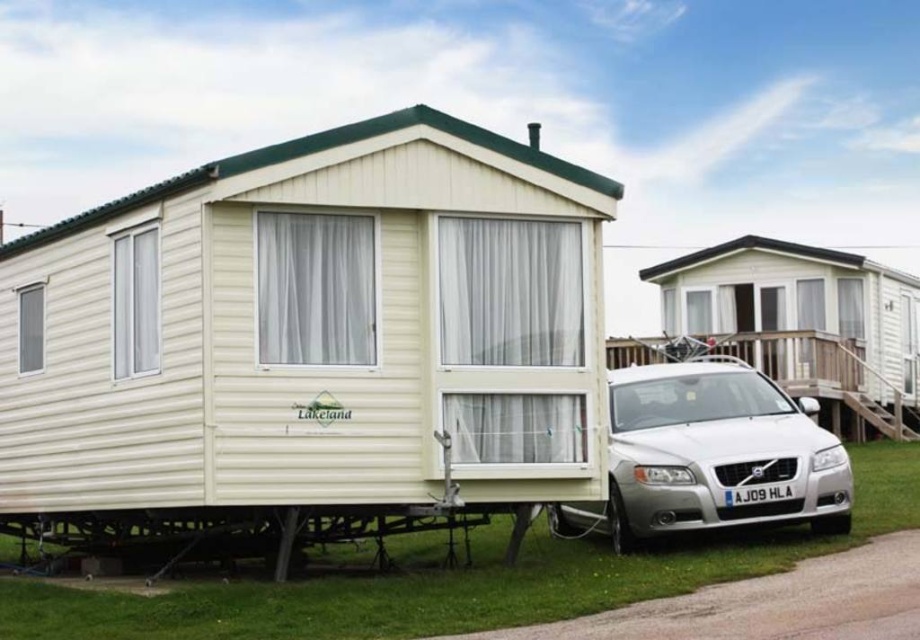
Looking at this image, you are standing at the mobile home and want to walk to the car parked in front. Which point, point (x=600, y=324) or point (x=662, y=502), is closer to the car?

Point (x=600, y=324) is closer to the car because it is in front of point (x=662, y=502).

You are planning to park a new van that requires clearance under a low bridge. You need to know which object in the image is shorter to estimate the bridge height. Which object between the beige vinyl camper at center and the silver metallic car at lower right is shorter?

The beige vinyl camper at center is shorter than the silver metallic car at lower right, so it would be the better reference for estimating the bridge height.